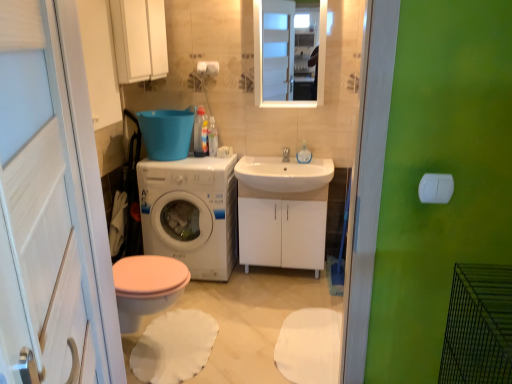
This screenshot has width=512, height=384. I want to click on blank area beneath white glossy cabinet at center (from a real-world perspective), so click(280, 274).